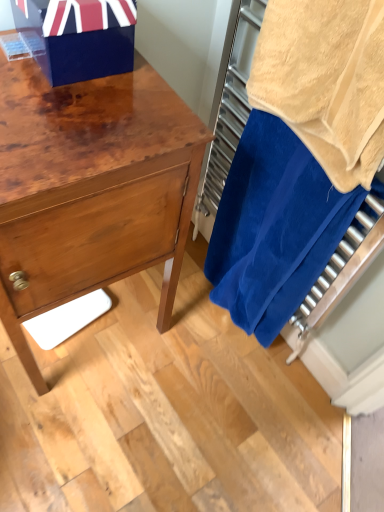
Question: In the image, is blue terry cloth towel at right positioned in front of or behind shiny wood chest of drawers at left?

Choices:
 (A) behind
 (B) front

Answer: (A)

Question: Considering the positions of blue terry cloth towel at right and shiny wood chest of drawers at left in the image, is blue terry cloth towel at right wider or thinner than shiny wood chest of drawers at left?

Choices:
 (A) thin
 (B) wide

Answer: (A)

Question: Which is nearer to the shiny wood chest of drawers at left?

Choices:
 (A) blue terry cloth towel at right
 (B) beige terry cloth towel at right
 (C) shiny blue gift box at upper left

Answer: (C)

Question: Estimate the real-world distances between objects in this image. Which object is closer to the blue terry cloth towel at right?

Choices:
 (A) shiny blue gift box at upper left
 (B) shiny wood chest of drawers at left
 (C) beige terry cloth towel at right

Answer: (C)